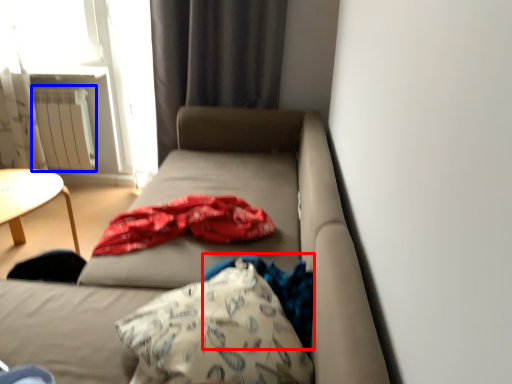
Question: Which object is further to the camera taking this photo, clothing (highlighted by a red box) or radiator (highlighted by a blue box)?

Choices:
 (A) clothing
 (B) radiator

Answer: (B)